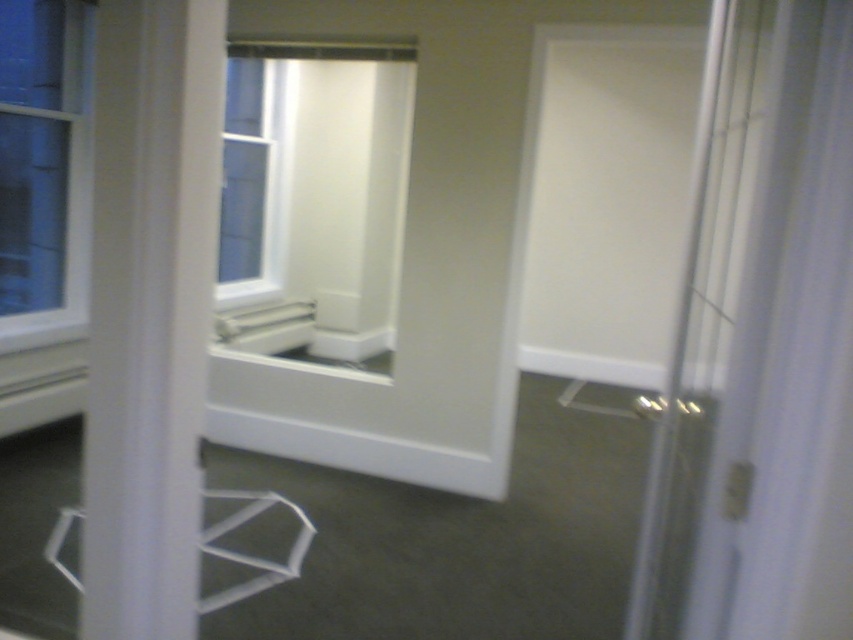
Based on the photo, is clear glass window at center taller than white plastic stool at lower left?

Correct, clear glass window at center is much taller as white plastic stool at lower left.

Which is more to the right, clear glass window at center or white plastic stool at lower left?

From the viewer's perspective, white plastic stool at lower left appears more on the right side.

This screenshot has height=640, width=853. What are the coordinates of `clear glass window at center` in the screenshot? It's located at (252, 177).

Which is behind, point (314, 282) or point (251, 516)?

The point (314, 282) is more distant.

Between white glossy window at center and white plastic stool at lower left, which one has less height?

With less height is white plastic stool at lower left.

Image resolution: width=853 pixels, height=640 pixels. What do you see at coordinates (312, 198) in the screenshot?
I see `white glossy window at center` at bounding box center [312, 198].

Locate an element on the screen. white glossy window at center is located at coordinates (312, 198).

Between white glossy window at center and clear glass window at center, which one is positioned higher?

clear glass window at center

Does white glossy window at center have a greater width compared to clear glass window at center?

Indeed, white glossy window at center has a greater width compared to clear glass window at center.

The width and height of the screenshot is (853, 640). What do you see at coordinates (312, 198) in the screenshot?
I see `white glossy window at center` at bounding box center [312, 198].

This screenshot has height=640, width=853. I want to click on white glossy window at center, so click(312, 198).